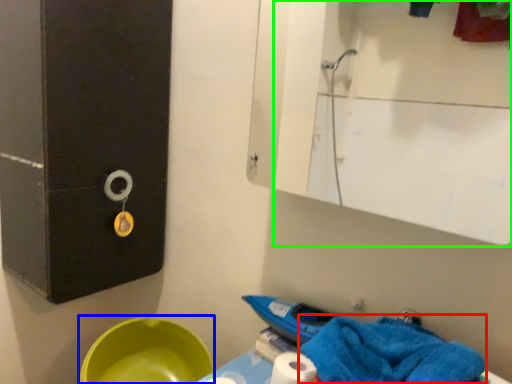
Question: Which object is the farthest from bath towel (highlighted by a red box)? Choose among these: basin (highlighted by a blue box) or mirror (highlighted by a green box).

Choices:
 (A) basin
 (B) mirror

Answer: (B)